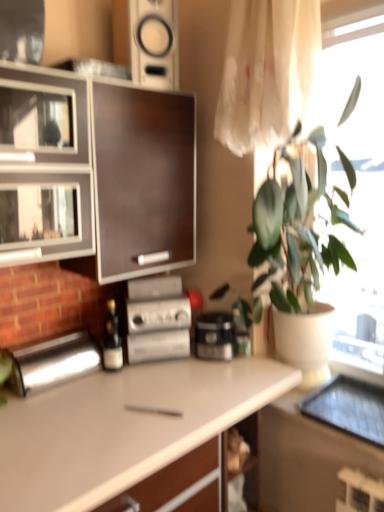
You are a GUI agent. You are given a task and a screenshot of the screen. Output one action in this format:
    pyautogui.click(x=<x>, y=<y>)
    Task: Click on the free spot in front of polished stainless steel bread bin at left, the 2th appliance positioned from the right
    
    Given the screenshot: What is the action you would take?
    (x=56, y=410)